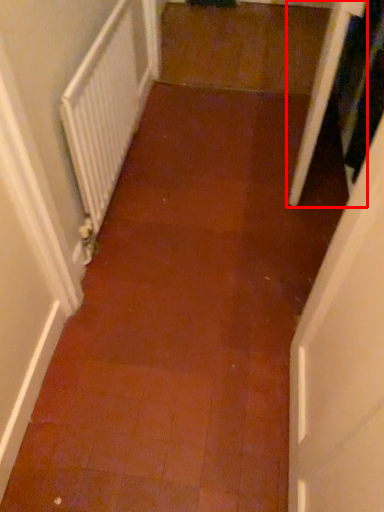
Question: Where is screen door (annotated by the red box) located in relation to radiator in the image?

Choices:
 (A) right
 (B) left

Answer: (A)